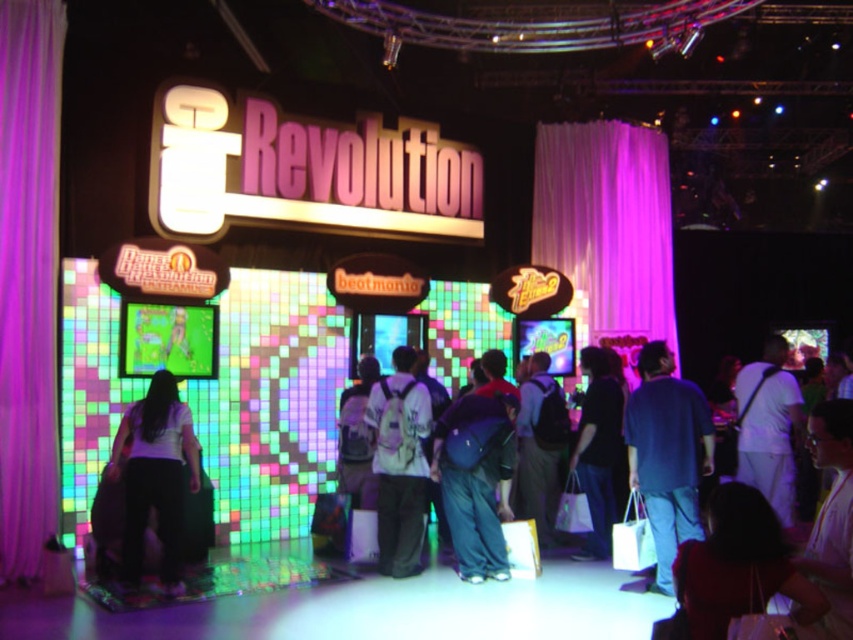
Question: Does white cotton shirt at right have a greater width compared to dark matte shirt at center?

Choices:
 (A) no
 (B) yes

Answer: (B)

Question: Which point is closer to the camera taking this photo?

Choices:
 (A) (500, 502)
 (B) (724, 522)

Answer: (B)

Question: Is matte white shirts at center below dark red fabric bag at lower right?

Choices:
 (A) yes
 (B) no

Answer: (B)

Question: Which object appears farthest from the camera in this image?

Choices:
 (A) white matte shirt at center
 (B) matte white shirts at center
 (C) dark red fabric bag at lower right
 (D) matte blue backpack at center

Answer: (D)

Question: Estimate the real-world distances between objects in this image. Which object is farther from the matte blue backpack at center?

Choices:
 (A) dark red fabric bag at lower right
 (B) dark matte shirt at center

Answer: (A)

Question: Does dark red fabric bag at lower right appear on the left side of white fabric backpack at center?

Choices:
 (A) no
 (B) yes

Answer: (A)